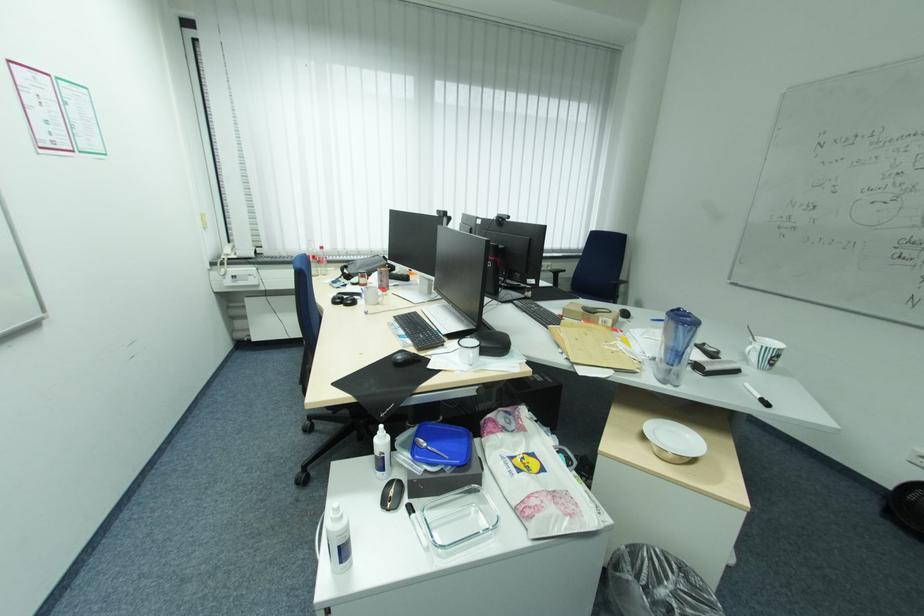
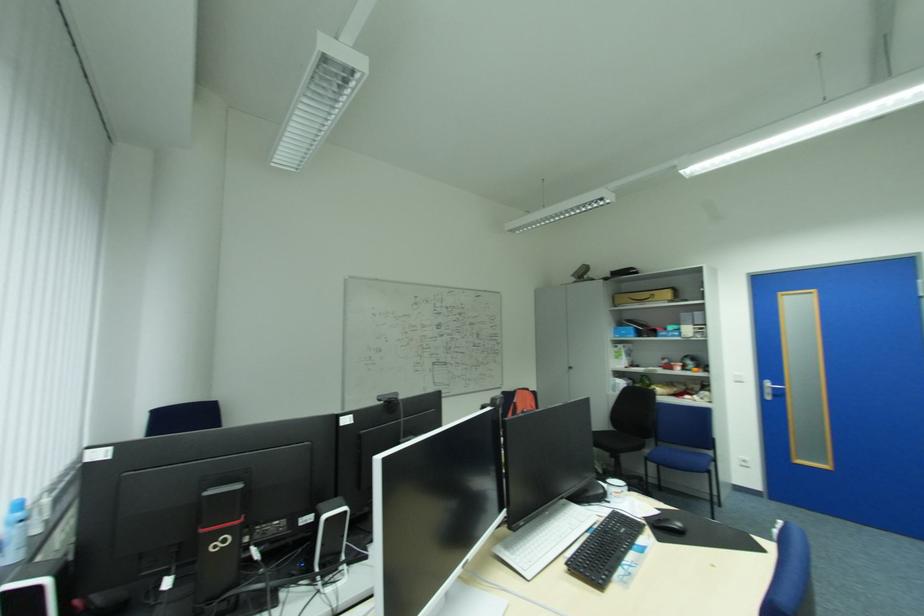
Where in the second image is the point corresponding to [478,355] from the first image?

(631, 485)